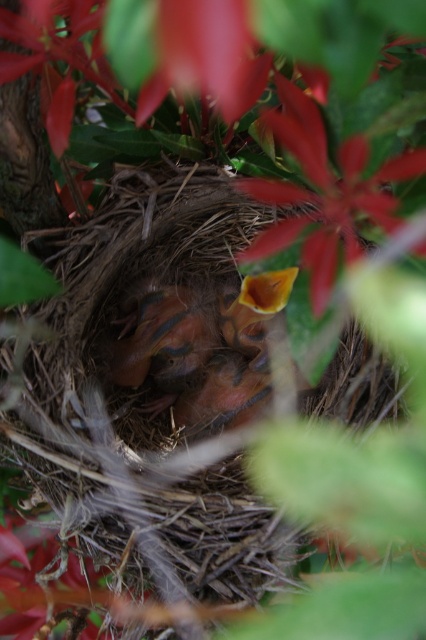
You are a birdwatcher trying to locate the orange smooth beak at center in the image. Based on the coordinates provided, where would you focus your attention?

The orange smooth beak at center is located at coordinates point (203, 349), so you should focus your attention there.

You are a birdwatcher observing a nest with baby birds. You notice an orange smooth beak at center and a smooth yellow petal at center. Which object takes up more space in the image?

The smooth yellow petal at center takes up more space than the orange smooth beak at center.